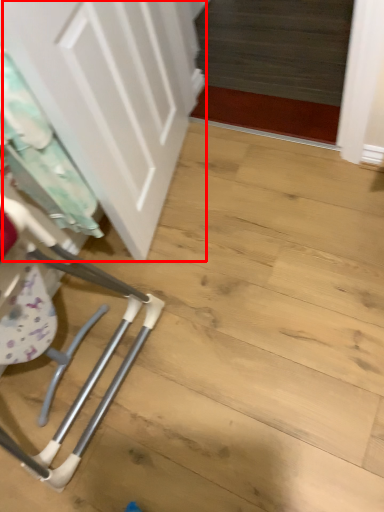
Question: In this image, where is door (annotated by the red box) located relative to laundry?

Choices:
 (A) left
 (B) right

Answer: (B)